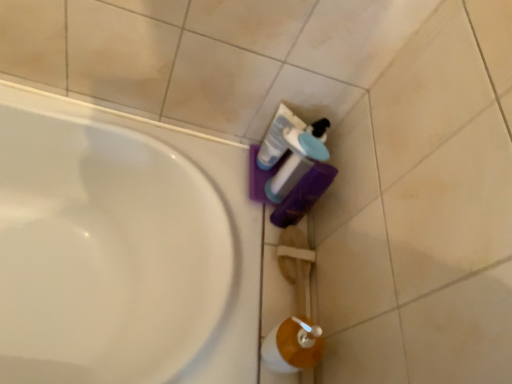
What do you see at coordinates (298, 159) in the screenshot? The image size is (512, 384). I see `translucent plastic bottle at lower right` at bounding box center [298, 159].

What are the coordinates of `translucent plastic bottle at lower right` in the screenshot? It's located at (298, 159).

The height and width of the screenshot is (384, 512). What do you see at coordinates (277, 137) in the screenshot?
I see `white glossy mouthwash at center` at bounding box center [277, 137].

Where is `white glossy mouthwash at center`? white glossy mouthwash at center is located at coordinates (277, 137).

You are a GUI agent. You are given a task and a screenshot of the screen. Output one action in this format:
    pyautogui.click(x=<x>, y=<y>)
    Task: Click on the translucent plastic bottle at lower right
    This screenshot has height=384, width=512.
    Given the screenshot: What is the action you would take?
    [298, 159]

Which is more to the right, translucent plastic bottle at lower right or white glossy mouthwash at center?

From the viewer's perspective, translucent plastic bottle at lower right appears more on the right side.

From the picture: Is translucent plastic bottle at lower right behind white glossy mouthwash at center?

No, translucent plastic bottle at lower right is closer to the camera.

Is point (283, 187) closer or farther from the camera than point (274, 141)?

Clearly, point (283, 187) is closer to the camera than point (274, 141).

From the image's perspective, who appears lower, translucent plastic bottle at lower right or white glossy mouthwash at center?

From the image's view, translucent plastic bottle at lower right is below.

From a real-world perspective, is translucent plastic bottle at lower right positioned above or below white glossy mouthwash at center?

From a real-world perspective, translucent plastic bottle at lower right is physically above white glossy mouthwash at center.

Considering the relative sizes of translucent plastic bottle at lower right and white glossy mouthwash at center in the image provided, is translucent plastic bottle at lower right thinner than white glossy mouthwash at center?

No, translucent plastic bottle at lower right is not thinner than white glossy mouthwash at center.

Considering the sizes of objects translucent plastic bottle at lower right and white glossy mouthwash at center in the image provided, who is taller, translucent plastic bottle at lower right or white glossy mouthwash at center?

translucent plastic bottle at lower right.

Between translucent plastic bottle at lower right and white glossy mouthwash at center, which one has larger size?

translucent plastic bottle at lower right.

Which is correct: translucent plastic bottle at lower right is inside white glossy mouthwash at center, or outside of it?

translucent plastic bottle at lower right cannot be found inside white glossy mouthwash at center.

Is translucent plastic bottle at lower right next to white glossy mouthwash at center?

Yes, translucent plastic bottle at lower right is right next to white glossy mouthwash at center and making contact.

Is translucent plastic bottle at lower right looking in the opposite direction of white glossy mouthwash at center?

Yes, translucent plastic bottle at lower right is facing away from white glossy mouthwash at center.

I want to click on mouthwash below the translucent plastic bottle at lower right (from a real-world perspective), so click(x=277, y=137).

Can you confirm if white glossy mouthwash at center is positioned to the right of translucent plastic bottle at lower right?

No, white glossy mouthwash at center is not to the right of translucent plastic bottle at lower right.

Is white glossy mouthwash at center behind translucent plastic bottle at lower right?

Yes, white glossy mouthwash at center is further from the viewer.

Considering the points (284, 126) and (306, 138), which point is behind, point (284, 126) or point (306, 138)?

The point (284, 126) is farther from the camera.

From the image's perspective, which is below, white glossy mouthwash at center or translucent plastic bottle at lower right?

translucent plastic bottle at lower right, from the image's perspective.

From a real-world perspective, between white glossy mouthwash at center and translucent plastic bottle at lower right, who is vertically higher?

From a 3D spatial view, translucent plastic bottle at lower right is above.

Looking at their sizes, would you say white glossy mouthwash at center is wider or thinner than translucent plastic bottle at lower right?

Considering their sizes, white glossy mouthwash at center looks slimmer than translucent plastic bottle at lower right.

Between white glossy mouthwash at center and translucent plastic bottle at lower right, which one has less height?

Standing shorter between the two is white glossy mouthwash at center.

Who is bigger, white glossy mouthwash at center or translucent plastic bottle at lower right?

With larger size is translucent plastic bottle at lower right.

Choose the correct answer: Is white glossy mouthwash at center inside translucent plastic bottle at lower right or outside it?

white glossy mouthwash at center lies outside translucent plastic bottle at lower right.

Are white glossy mouthwash at center and translucent plastic bottle at lower right beside each other?

Indeed, white glossy mouthwash at center and translucent plastic bottle at lower right are beside each other and touching.

Is white glossy mouthwash at center looking in the opposite direction of translucent plastic bottle at lower right?

white glossy mouthwash at center does not have its back to translucent plastic bottle at lower right.

You are a GUI agent. You are given a task and a screenshot of the screen. Output one action in this format:
    pyautogui.click(x=<x>, y=<y>)
    Task: Click on the mouthwash that is behind the translucent plastic bottle at lower right
    
    Given the screenshot: What is the action you would take?
    pyautogui.click(x=277, y=137)

Image resolution: width=512 pixels, height=384 pixels. Find the location of `cleaning product in front of the white glossy mouthwash at center`. cleaning product in front of the white glossy mouthwash at center is located at coordinates (298, 159).

Find the location of `mouthwash lying behind the translucent plastic bottle at lower right`. mouthwash lying behind the translucent plastic bottle at lower right is located at coordinates (277, 137).